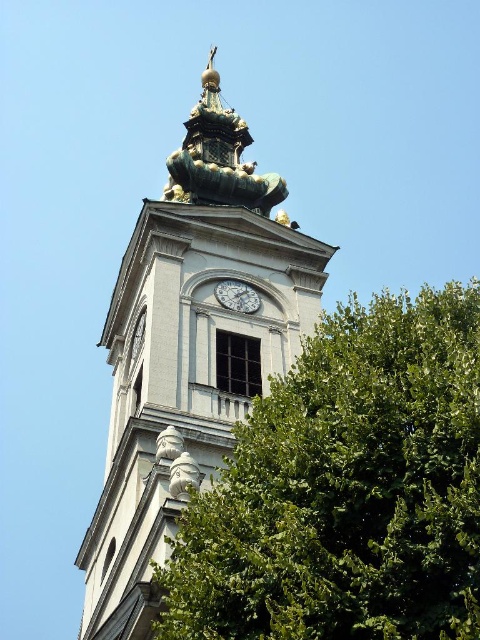
You are an architect designing a new building and want to ensure that the white stone clock tower at center and the silver metallic clock at center are proportionate. Based on the image, which object should be scaled down to maintain proper proportions?

The silver metallic clock at center should be scaled down because the white stone clock tower at center is much taller, so reducing the size of the silver metallic clock at center would help maintain proportionality between the two objects.

You are standing in front of the church tower and want to take a photo of both the green leafy tree at center and the silver metallic clock at center. How far apart are these two objects from each other?

The green leafy tree at center is 55.53 feet away from the silver metallic clock at center.

You are standing in front of the church tower and want to take a photo of both the green leafy tree at center and the white stone clock tower at center. Which object should you frame first if you want to ensure both are fully visible in the photo?

The green leafy tree at center might be wider than the white stone clock tower at center, so you should frame the wider object first to ensure both fit in the photo.